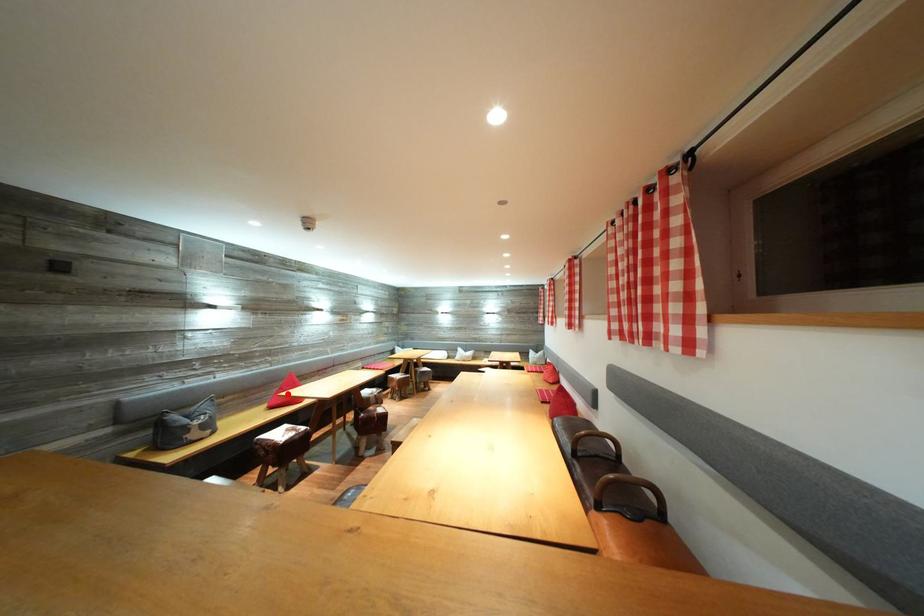
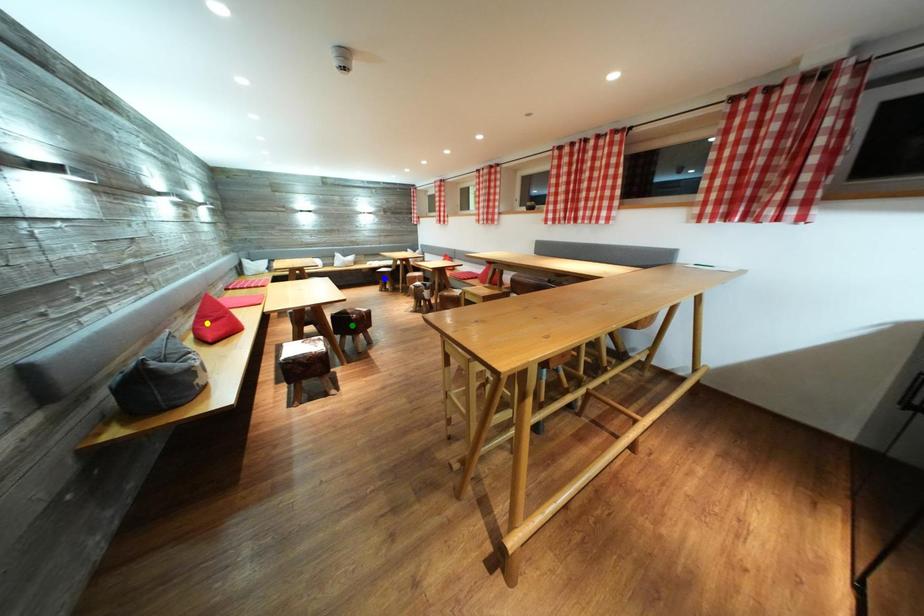
Question: I am providing you with two images of the same scene from different viewpoints. A red point is marked on the first image. You are given multiple points on the second image. In image 2, which mark is for the same physical point as the one in image 1?

Choices:
 (A) blue point
 (B) yellow point
 (C) green point

Answer: (B)